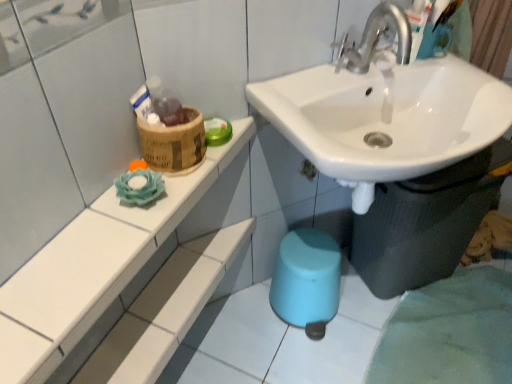
Looking at this image, measure the distance between bamboo basket at upper left and camera.

A distance of 88.85 centimeters exists between bamboo basket at upper left and camera.

You are a GUI agent. You are given a task and a screenshot of the screen. Output one action in this format:
    pyautogui.click(x=<x>, y=<y>)
    Task: Click on the white ceramic shelf at upper left
    This screenshot has height=384, width=512.
    Given the screenshot: What is the action you would take?
    pyautogui.click(x=93, y=267)

Between white glossy sink at center and bamboo basket at upper left, which one appears on the left side from the viewer's perspective?

From the viewer's perspective, bamboo basket at upper left appears more on the left side.

Can you tell me how much white glossy sink at center and bamboo basket at upper left differ in facing direction?

33.2 degrees separate the facing orientations of white glossy sink at center and bamboo basket at upper left.

Would you say white glossy sink at center contains bamboo basket at upper left?

No, bamboo basket at upper left is not a part of white glossy sink at center.

From a real-world perspective, which is physically below, white glossy sink at center or bamboo basket at upper left?

In real-world perspective, white glossy sink at center is lower.

Considering the relative sizes of white glossy sink at center and white ceramic shelf at upper left in the image provided, is white glossy sink at center thinner than white ceramic shelf at upper left?

In fact, white glossy sink at center might be wider than white ceramic shelf at upper left.

Which is behind, white glossy sink at center or white ceramic shelf at upper left?

white glossy sink at center is further away from the camera.

What's the angular difference between bamboo basket at upper left and white glossy sink at center's facing directions?

They differ by 33.2 degrees in their facing directions.

Does point (160, 143) lie behind point (289, 137)?

No, (160, 143) is in front of (289, 137).

This screenshot has height=384, width=512. Identify the location of sink lying on the right of bamboo basket at upper left. (385, 112).

Is bamboo basket at upper left spatially inside white glossy sink at center, or outside of it?

bamboo basket at upper left is outside white glossy sink at center.

Locate an element on the screen. counter top below the bamboo basket at upper left (from a real-world perspective) is located at coordinates (93, 267).

Between white ceramic shelf at upper left and bamboo basket at upper left, which one has larger width?

white ceramic shelf at upper left is wider.

Does white ceramic shelf at upper left turn towards bamboo basket at upper left?

No, white ceramic shelf at upper left is not aimed at bamboo basket at upper left.

Who is more distant, white ceramic shelf at upper left or white glossy sink at center?

Positioned behind is white glossy sink at center.

Where is `counter top in front of the white glossy sink at center`? counter top in front of the white glossy sink at center is located at coordinates (93, 267).

Is white ceramic shelf at upper left shorter than white glossy sink at center?

Indeed, white ceramic shelf at upper left has a lesser height compared to white glossy sink at center.

Is white ceramic shelf at upper left spatially inside white glossy sink at center, or outside of it?

white ceramic shelf at upper left cannot be found inside white glossy sink at center.

Based on the photo, from a real-world perspective, is bamboo basket at upper left physically located above or below white ceramic shelf at upper left?

bamboo basket at upper left is situated higher than white ceramic shelf at upper left in the real world.

Which point is more distant from viewer, (140,141) or (110,366)?

The point (110,366) is farther from the camera.

Looking at their sizes, would you say bamboo basket at upper left is wider or thinner than white ceramic shelf at upper left?

Considering their sizes, bamboo basket at upper left looks slimmer than white ceramic shelf at upper left.

Is bamboo basket at upper left taller or shorter than white ceramic shelf at upper left?

bamboo basket at upper left is taller than white ceramic shelf at upper left.

Find the location of a particular element. This screenshot has width=512, height=384. potty above the white glossy sink at center (from a real-world perspective) is located at coordinates (174, 144).

Locate an element on the screen. counter top on the left of white glossy sink at center is located at coordinates (93, 267).

Estimate the real-world distances between objects in this image. Which object is closer to white glossy sink at center, bamboo basket at upper left or white ceramic shelf at upper left?

Based on the image, white ceramic shelf at upper left appears to be nearer to white glossy sink at center.

Looking at the image, which one is located further to white glossy sink at center, white ceramic shelf at upper left or bamboo basket at upper left?

bamboo basket at upper left.

Looking at this image, from the image, which object appears to be nearer to white ceramic shelf at upper left, white glossy sink at center or bamboo basket at upper left?

bamboo basket at upper left.

Looking at this image, which object lies nearer to the anchor point white ceramic shelf at upper left, bamboo basket at upper left or white glossy sink at center?

The object closer to white ceramic shelf at upper left is bamboo basket at upper left.

From the image, which object appears to be farther from bamboo basket at upper left, white glossy sink at center or white ceramic shelf at upper left?

white glossy sink at center.

Based on their spatial positions, is white ceramic shelf at upper left or white glossy sink at center further from bamboo basket at upper left?

white glossy sink at center is positioned further to the anchor bamboo basket at upper left.

Image resolution: width=512 pixels, height=384 pixels. I want to click on potty between white ceramic shelf at upper left and white glossy sink at center from left to right, so click(x=174, y=144).